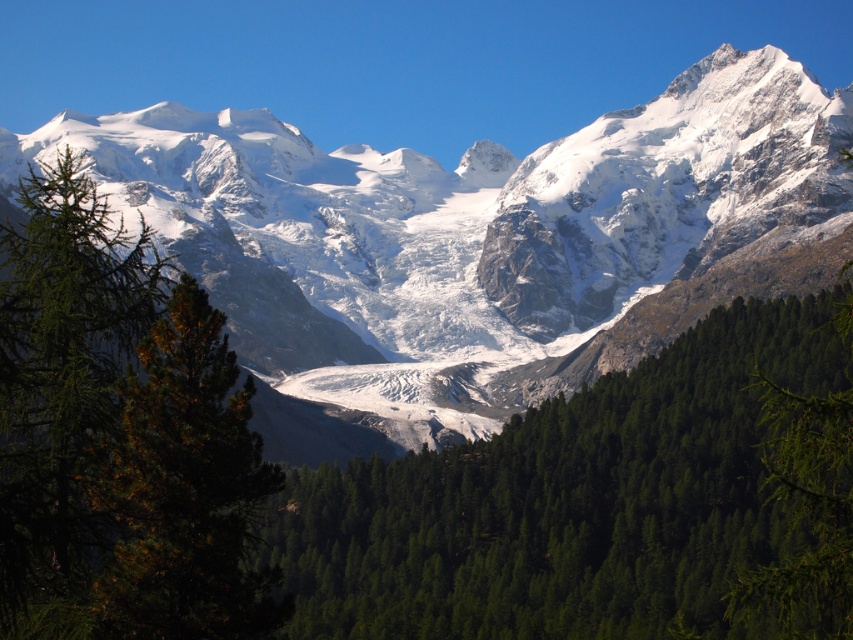
Who is more distant from viewer, (228, 467) or (778, 474)?

Positioned behind is point (778, 474).

Between green needle-like tree at center-left and green matte tree at right, which one has less height?

green needle-like tree at center-left is shorter.

Describe the element at coordinates (184, 490) in the screenshot. I see `green needle-like tree at center-left` at that location.

Identify the location of green needle-like tree at center-left. The width and height of the screenshot is (853, 640). (184, 490).

Is green matte tree at center closer to the viewer compared to green needle-like tree at center-left?

That is False.

Is point (352, 540) behind point (219, 384)?

Yes, it is behind point (219, 384).

The width and height of the screenshot is (853, 640). I want to click on green matte tree at center, so click(x=576, y=500).

At what (x,y) coordinates should I click in order to perform the action: click on green matte tree at center. Please return your answer as a coordinate pair (x, y). Looking at the image, I should click on (576, 500).

Can you confirm if green matte tree at center is shorter than green matte tree at right?

No.

Does green matte tree at center appear on the right side of green matte tree at right?

Incorrect, green matte tree at center is not on the right side of green matte tree at right.

Does point (740, 312) lie in front of point (753, 572)?

No, it is not.

Locate an element on the screen. This screenshot has width=853, height=640. green matte tree at center is located at coordinates (576, 500).